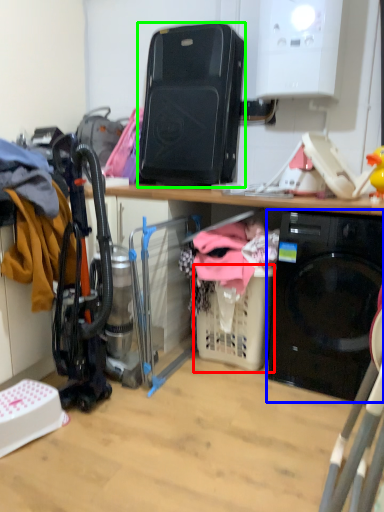
Question: Estimate the real-world distances between objects in this image. Which object is closer to basket (highlighted by a red box), home appliance (highlighted by a blue box) or appliance (highlighted by a green box)?

Choices:
 (A) home appliance
 (B) appliance

Answer: (A)